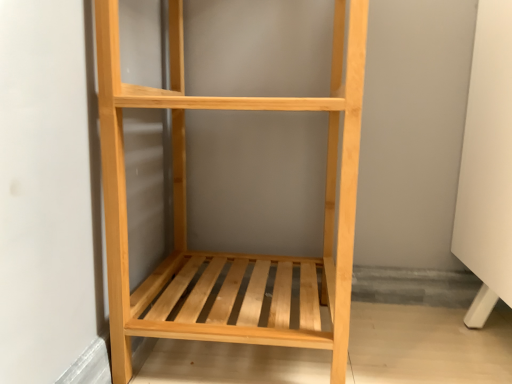
What do you see at coordinates (229, 253) in the screenshot? This screenshot has width=512, height=384. I see `natural wood shelf at center` at bounding box center [229, 253].

Locate an element on the screen. Image resolution: width=512 pixels, height=384 pixels. natural wood shelf at center is located at coordinates (229, 253).

What are the coordinates of `natural wood shelf at center` in the screenshot? It's located at [x=229, y=253].